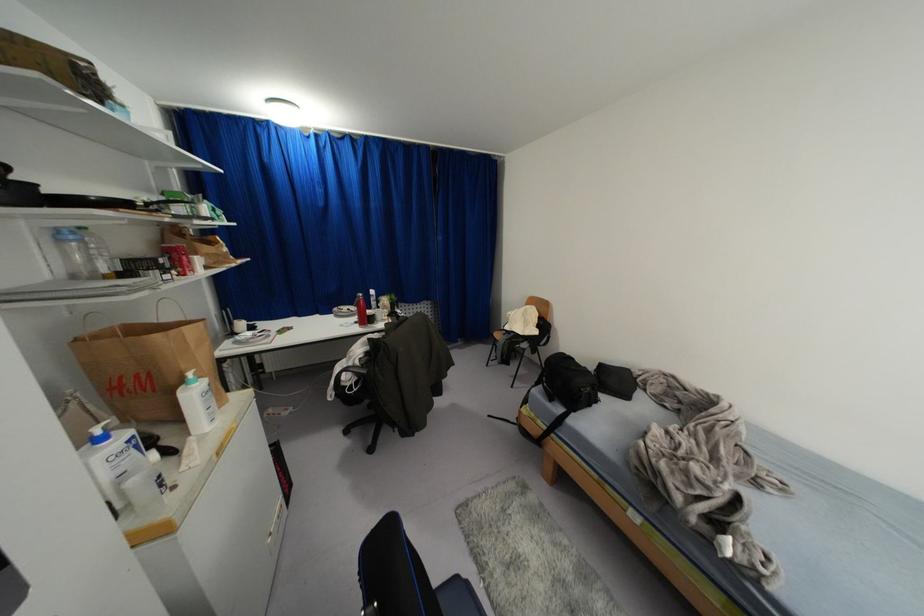
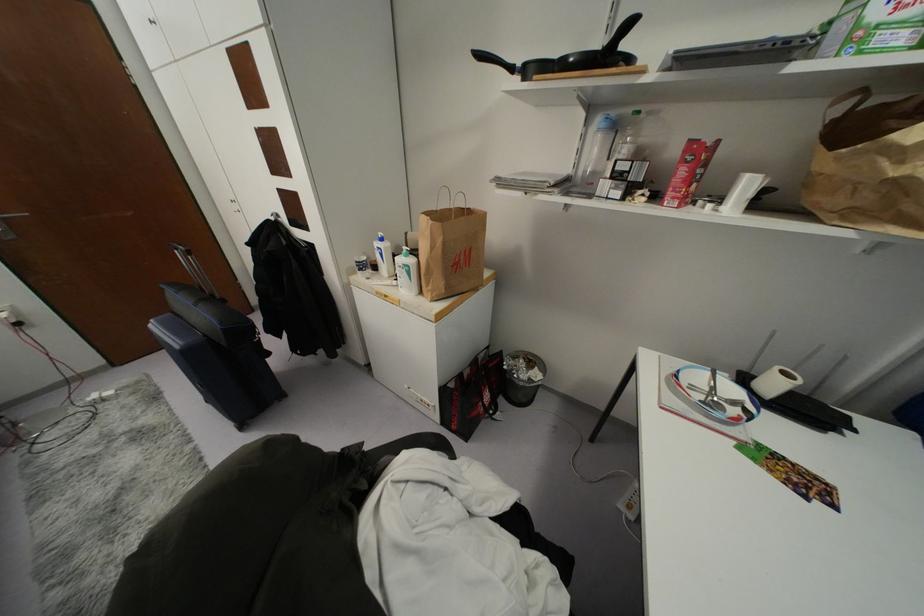
The point at (137, 446) is marked in the first image. Where is the corresponding point in the second image?

(381, 254)